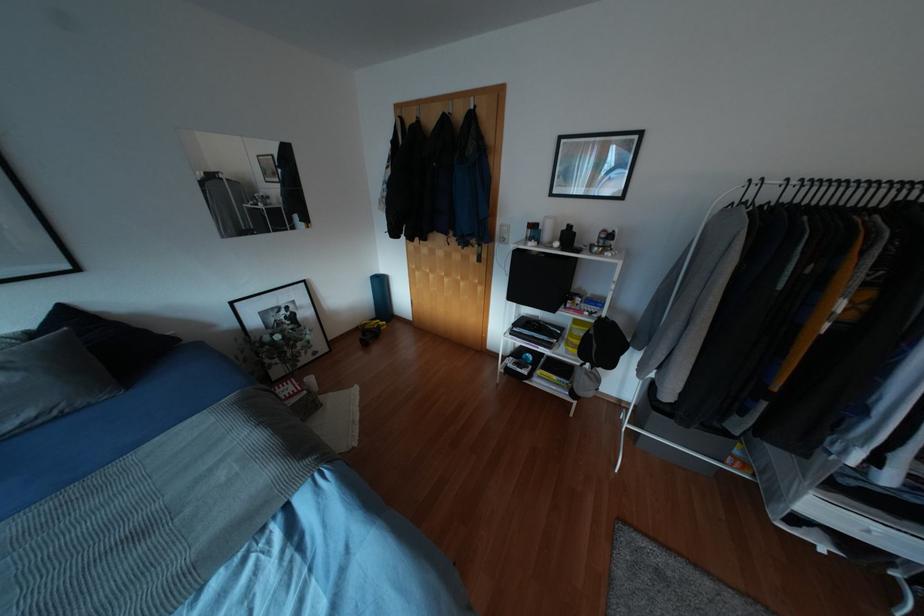
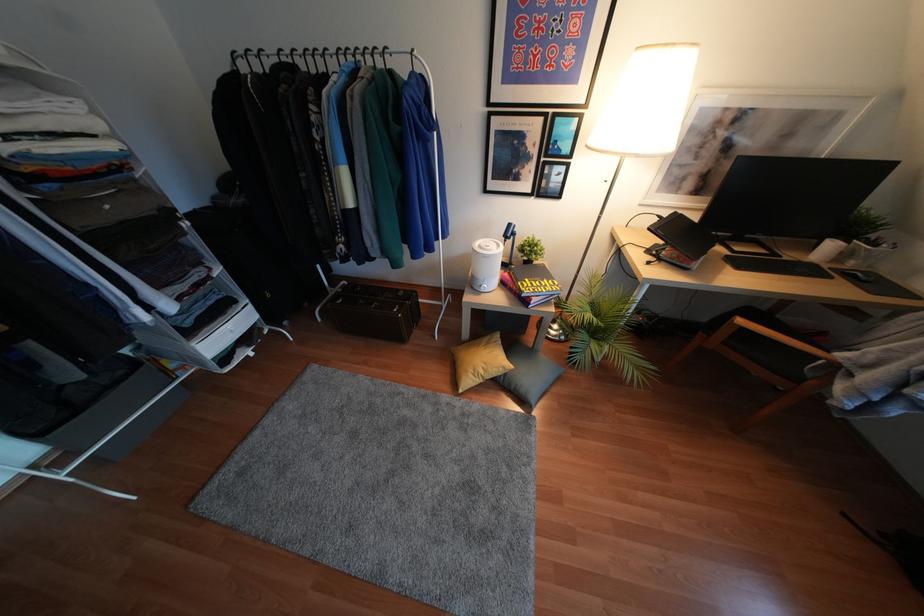
The images are taken continuously from a first-person perspective. In which direction is your viewpoint rotating?

The camera rotated toward right-down.